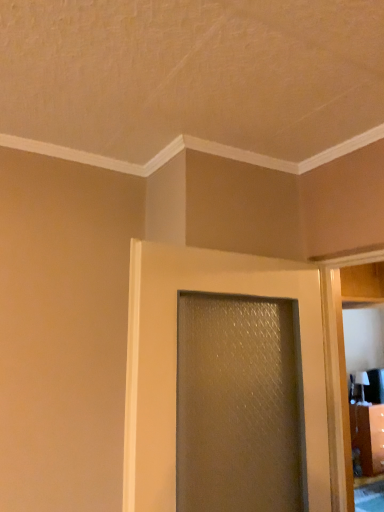
Question: Considering the relative sizes of matte white elevator at right and satin gold textured door at center in the image provided, is matte white elevator at right taller than satin gold textured door at center?

Choices:
 (A) yes
 (B) no

Answer: (A)

Question: Is matte white elevator at right surrounding satin gold textured door at center?

Choices:
 (A) yes
 (B) no

Answer: (B)

Question: From the image's perspective, is matte white elevator at right located beneath satin gold textured door at center?

Choices:
 (A) yes
 (B) no

Answer: (A)

Question: Is matte white elevator at right next to satin gold textured door at center?

Choices:
 (A) no
 (B) yes

Answer: (A)

Question: From a real-world perspective, is matte white elevator at right on satin gold textured door at center?

Choices:
 (A) no
 (B) yes

Answer: (A)

Question: Considering the relative sizes of matte white elevator at right and satin gold textured door at center in the image provided, is matte white elevator at right shorter than satin gold textured door at center?

Choices:
 (A) no
 (B) yes

Answer: (A)

Question: Does satin gold textured door at center have a larger size compared to matte white elevator at right?

Choices:
 (A) yes
 (B) no

Answer: (A)

Question: Does satin gold textured door at center contain matte white elevator at right?

Choices:
 (A) no
 (B) yes

Answer: (A)

Question: From the image's perspective, is satin gold textured door at center on top of matte white elevator at right?

Choices:
 (A) yes
 (B) no

Answer: (A)

Question: Can you confirm if satin gold textured door at center is taller than matte white elevator at right?

Choices:
 (A) yes
 (B) no

Answer: (B)

Question: Is satin gold textured door at center beside matte white elevator at right?

Choices:
 (A) no
 (B) yes

Answer: (A)

Question: Does satin gold textured door at center come behind matte white elevator at right?

Choices:
 (A) no
 (B) yes

Answer: (A)

Question: In terms of height, does matte white elevator at right look taller or shorter compared to satin gold textured door at center?

Choices:
 (A) short
 (B) tall

Answer: (B)